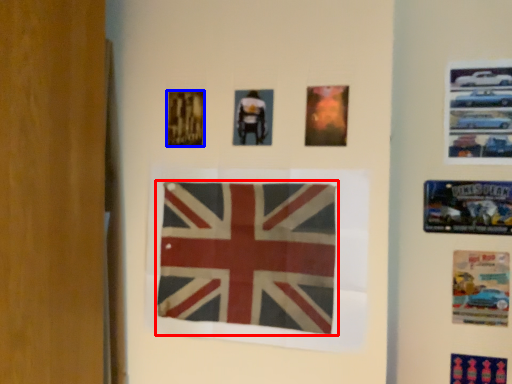
Question: Which of the following is the closest to the observer, flag (highlighted by a red box) or poster (highlighted by a blue box)?

Choices:
 (A) flag
 (B) poster

Answer: (A)